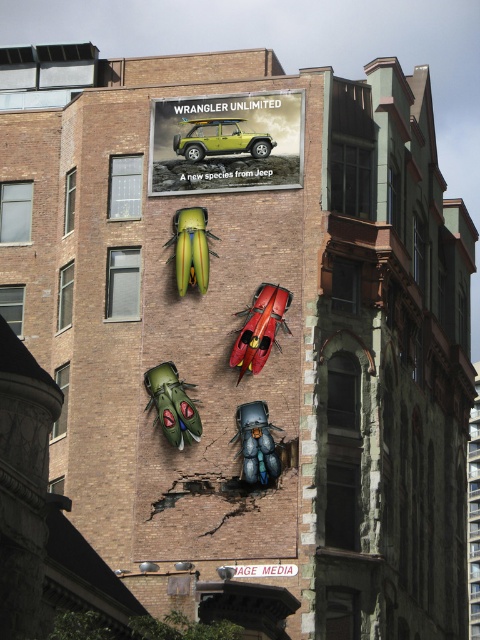
You are standing in front of the building and want to take a photo of the green metallic beetle at center. Where should you position yourself to capture the beetle in the best possible view?

The green metallic beetle at center is located at point 0.633 on the horizontal axis and 0.360 on the vertical axis. To capture it in the best possible view, position yourself directly in front of the building at the center, slightly to the right to align with the beetle.

You are an art curator planning to install a new sculpture in the building. You have a green metallic beetle at center and a matte green plastic car at upper center. Which of these two objects is smaller in size?

The green metallic beetle at center is smaller in size compared to the matte green plastic car at upper center.